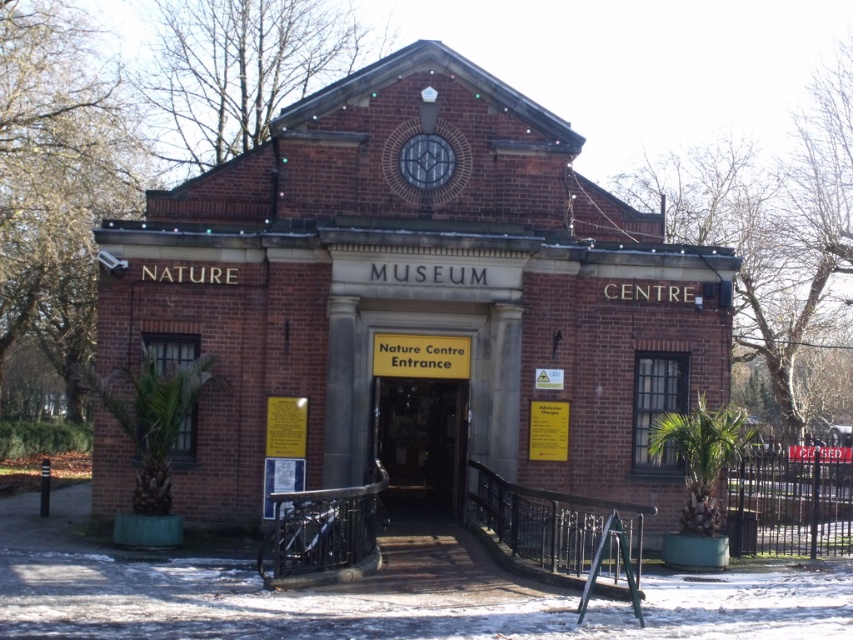
Who is higher up, brick building at center or wooden door at center?

Positioned higher is brick building at center.

Is brick building at center thinner than wooden door at center?

No.

The height and width of the screenshot is (640, 853). I want to click on brick building at center, so click(x=416, y=292).